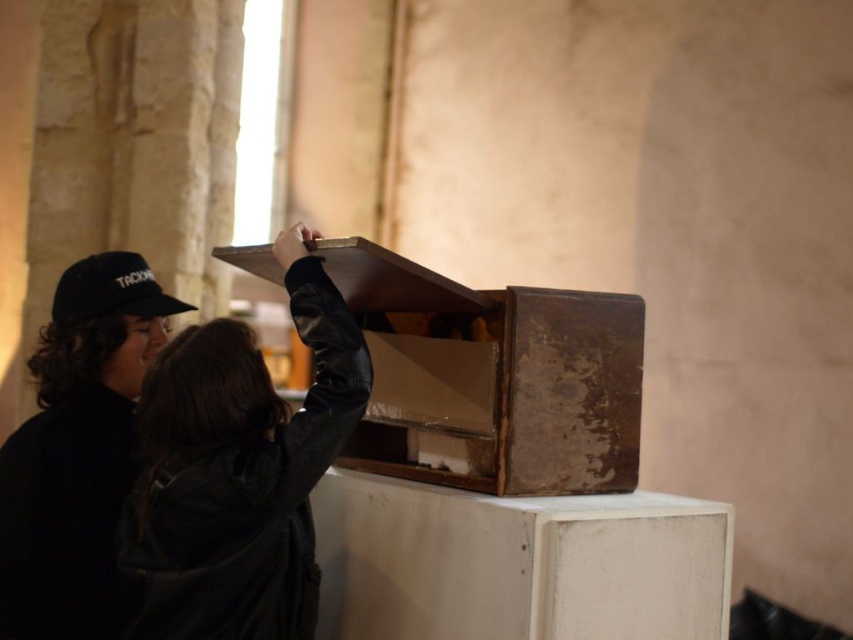
You are standing in front of the wooden object on the pedestal. There are two points marked on the pedestal. One is at coordinate point [363,456] and the other is at point [64,284]. Which point is closer to you?

Point [363,456] is closer to the camera than point [64,284], so the point at [363,456] is closer to you.

Based on the scene description, what object is located at the coordinates point (492, 378)?

The object at point (492, 378) is a rusty wood box at center.